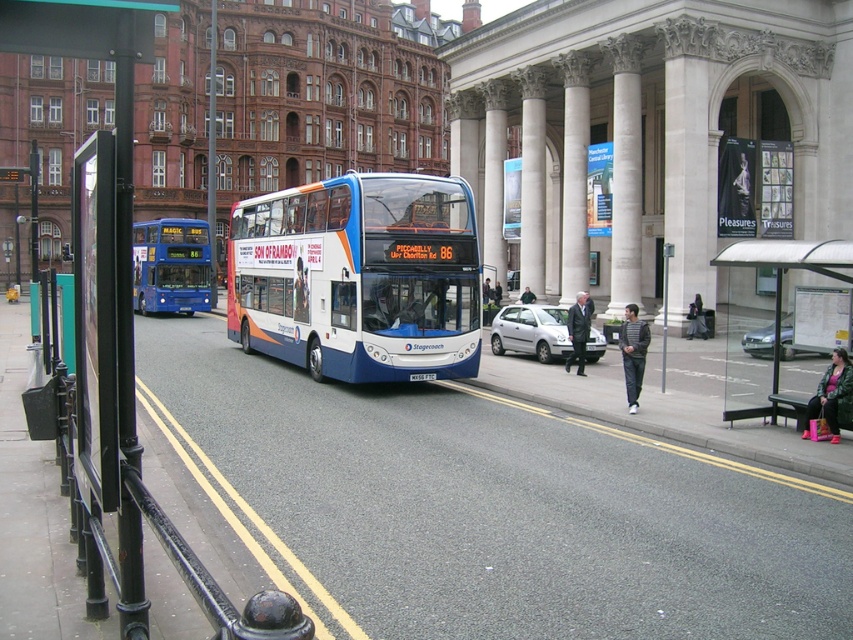
Is silver metallic hatchback at center to the left of striped sweater at lower right from the viewer's perspective?

Correct, you'll find silver metallic hatchback at center to the left of striped sweater at lower right.

Which of these two, silver metallic hatchback at center or striped sweater at lower right, stands taller?

Standing taller between the two is striped sweater at lower right.

Between point (532, 323) and point (630, 392), which one is positioned in front?

Positioned in front is point (630, 392).

At what (x,y) coordinates should I click in order to perform the action: click on silver metallic hatchback at center. Please return your answer as a coordinate pair (x, y). The height and width of the screenshot is (640, 853). Looking at the image, I should click on (531, 332).

Is dark gray suit at center to the left of dark gray jacket at center from the viewer's perspective?

Incorrect, dark gray suit at center is not on the left side of dark gray jacket at center.

Between dark gray suit at center and dark gray jacket at center, which one is positioned lower?

dark gray suit at center is below.

What do you see at coordinates (578, 332) in the screenshot? I see `dark gray suit at center` at bounding box center [578, 332].

Find the location of a particular element. The width and height of the screenshot is (853, 640). dark gray suit at center is located at coordinates (578, 332).

Is point (276, 214) farther from camera compared to point (842, 467)?

Yes, it is.

Is point (338, 214) closer to viewer compared to point (514, 394)?

Yes, it is.

You are a GUI agent. You are given a task and a screenshot of the screen. Output one action in this format:
    pyautogui.click(x=<x>, y=<y>)
    Task: Click on the white glossy bus at center
    The height and width of the screenshot is (640, 853).
    Given the screenshot: What is the action you would take?
    (358, 276)